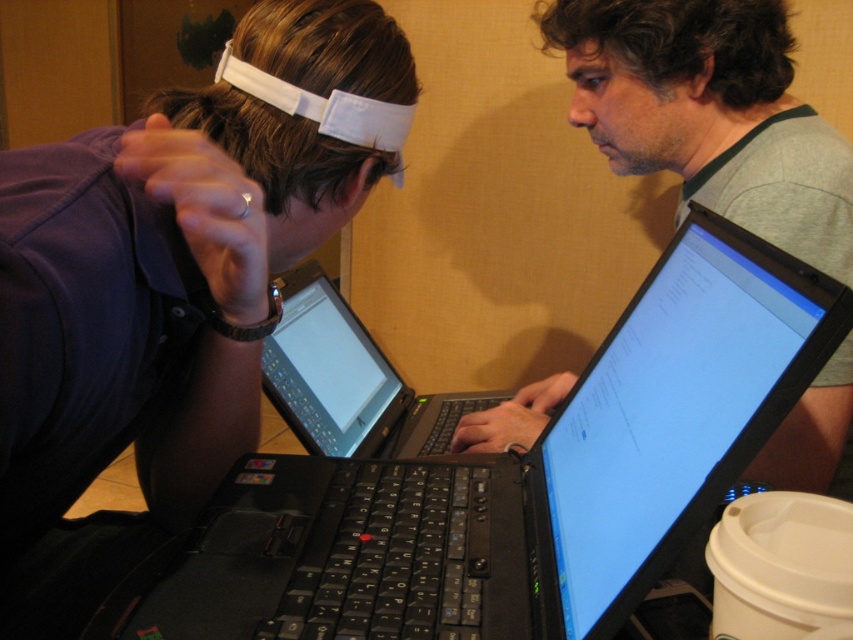
Does matte white forehead at upper center have a greater width compared to black plastic laptop at center?

Indeed, matte white forehead at upper center has a greater width compared to black plastic laptop at center.

This screenshot has height=640, width=853. What do you see at coordinates (181, 257) in the screenshot? I see `matte white forehead at upper center` at bounding box center [181, 257].

You are a GUI agent. You are given a task and a screenshot of the screen. Output one action in this format:
    pyautogui.click(x=<x>, y=<y>)
    Task: Click on the matte white forehead at upper center
    
    Given the screenshot: What is the action you would take?
    pyautogui.click(x=181, y=257)

Is matte white forehead at upper center shorter than gray-green fabric shirt at center?

Yes, matte white forehead at upper center is shorter than gray-green fabric shirt at center.

Who is higher up, matte white forehead at upper center or gray-green fabric shirt at center?

gray-green fabric shirt at center is higher up.

What are the coordinates of `matte white forehead at upper center` in the screenshot? It's located at (181, 257).

Is gray-green fabric shirt at center smaller than black plastic laptop at center?

Actually, gray-green fabric shirt at center might be larger than black plastic laptop at center.

In the scene shown: Between gray-green fabric shirt at center and black plastic laptop at center, which one appears on the right side from the viewer's perspective?

gray-green fabric shirt at center

At what (x,y) coordinates should I click in order to perform the action: click on gray-green fabric shirt at center. Please return your answer as a coordinate pair (x, y). Looking at the image, I should click on (709, 113).

The width and height of the screenshot is (853, 640). I want to click on gray-green fabric shirt at center, so click(709, 113).